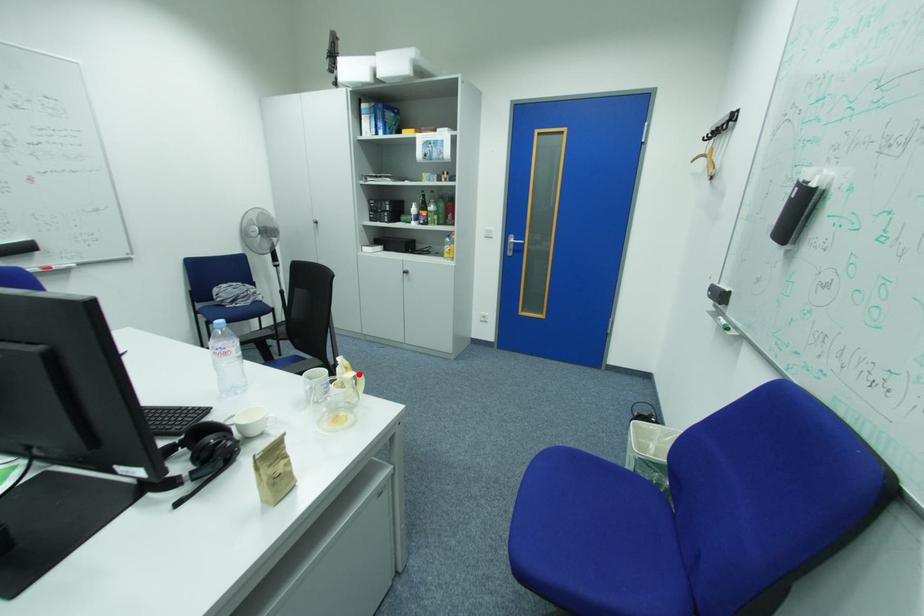
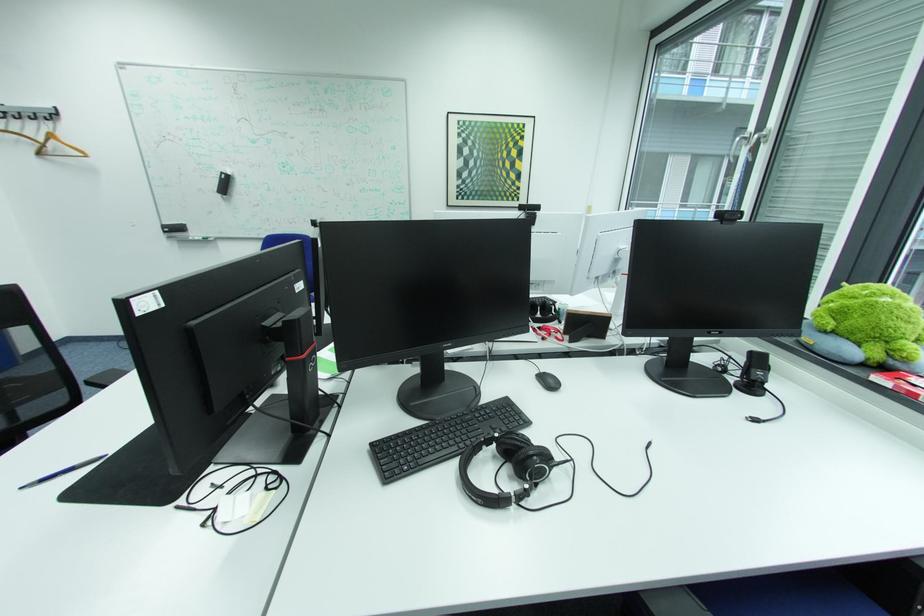
Question: I am providing you with two images of the same scene from different viewpoints. A red point is marked on the first image. Is the red point's position out of view in image 2?

Choices:
 (A) Yes
 (B) No

Answer: (A)